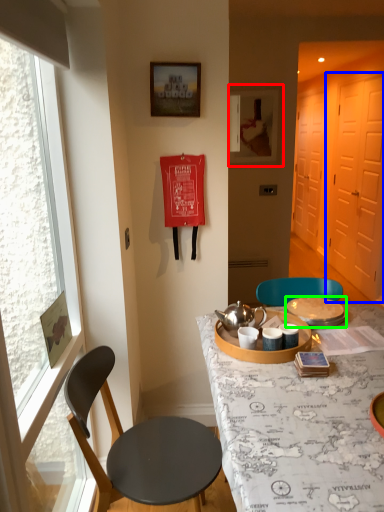
Question: Considering the real-world distances, which object is closest to picture frame (highlighted by a red box)? screen door (highlighted by a blue box) or tableware (highlighted by a green box).

Choices:
 (A) screen door
 (B) tableware

Answer: (A)